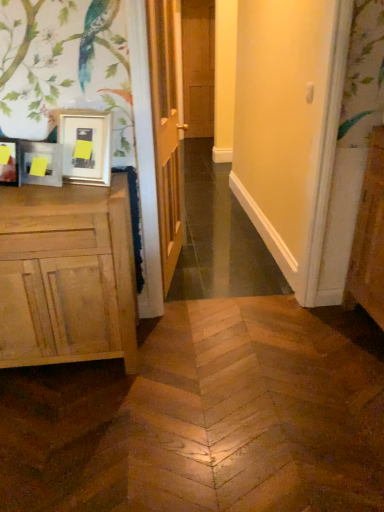
Question: From the image's perspective, is brown wooden door at center, marked as the 2th door in a front-to-back arrangement, located beneath wooden door at center, placed as the second door when sorted from top to bottom?

Choices:
 (A) yes
 (B) no

Answer: (B)

Question: Is brown wooden door at center, marked as the 2th door in a front-to-back arrangement, further to the viewer compared to wooden door at center, positioned as the 1th door in bottom-to-top order?

Choices:
 (A) no
 (B) yes

Answer: (B)

Question: Does brown wooden door at center, the 1th door viewed from the top, have a greater width compared to wooden door at center, placed as the second door when sorted from top to bottom?

Choices:
 (A) no
 (B) yes

Answer: (A)

Question: Is brown wooden door at center, which is the second door in bottom-to-top order, positioned with its back to wooden door at center, positioned as the 1th door in bottom-to-top order?

Choices:
 (A) yes
 (B) no

Answer: (B)

Question: From the image's perspective, does brown wooden door at center, which is the second door in bottom-to-top order, appear higher than wooden door at center, placed as the second door when sorted from top to bottom?

Choices:
 (A) yes
 (B) no

Answer: (A)

Question: Is wooden door at center, marked as the second door in a back-to-front arrangement, inside brown wooden door at center, acting as the 1th door starting from the back?

Choices:
 (A) yes
 (B) no

Answer: (B)

Question: Does natural wood cabinet at left have a lesser width compared to matte wood screen door at center?

Choices:
 (A) no
 (B) yes

Answer: (A)

Question: Is matte wood screen door at center at the back of natural wood cabinet at left?

Choices:
 (A) no
 (B) yes

Answer: (A)

Question: Is natural wood cabinet at left bigger than matte wood screen door at center?

Choices:
 (A) yes
 (B) no

Answer: (A)

Question: Considering the relative sizes of natural wood cabinet at left and matte wood screen door at center in the image provided, is natural wood cabinet at left wider than matte wood screen door at center?

Choices:
 (A) yes
 (B) no

Answer: (A)

Question: Does natural wood cabinet at left appear on the left side of matte wood screen door at center?

Choices:
 (A) yes
 (B) no

Answer: (A)

Question: From a real-world perspective, is natural wood cabinet at left positioned under matte wood screen door at center based on gravity?

Choices:
 (A) no
 (B) yes

Answer: (B)

Question: Is wooden door at center, acting as the 1th door starting from the front, wider than brown wooden door at center, which is the second door in bottom-to-top order?

Choices:
 (A) yes
 (B) no

Answer: (A)